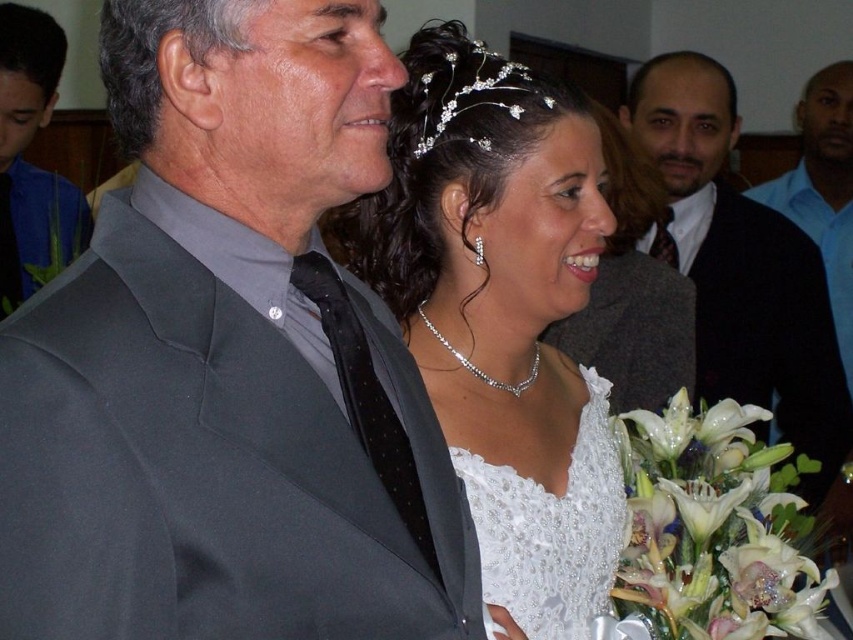
Consider the image. You are a photographer at the wedding and need to adjust the camera focus. Which object, the matte gray suit at left or the dark brown skin at upper right, is narrower in width?

The matte gray suit at left has a lesser width compared to the dark brown skin at upper right, so the matte gray suit at left is narrower in width.

You are a photographer at the wedding and want to capture a photo that includes both the pearl necklace at center and the blue shirt at upper right. Which object should you focus on first to ensure both are in the frame?

The pearl necklace at center is in front of the blue shirt at upper right, so you should focus on the pearl necklace at center first to ensure both are in the frame.